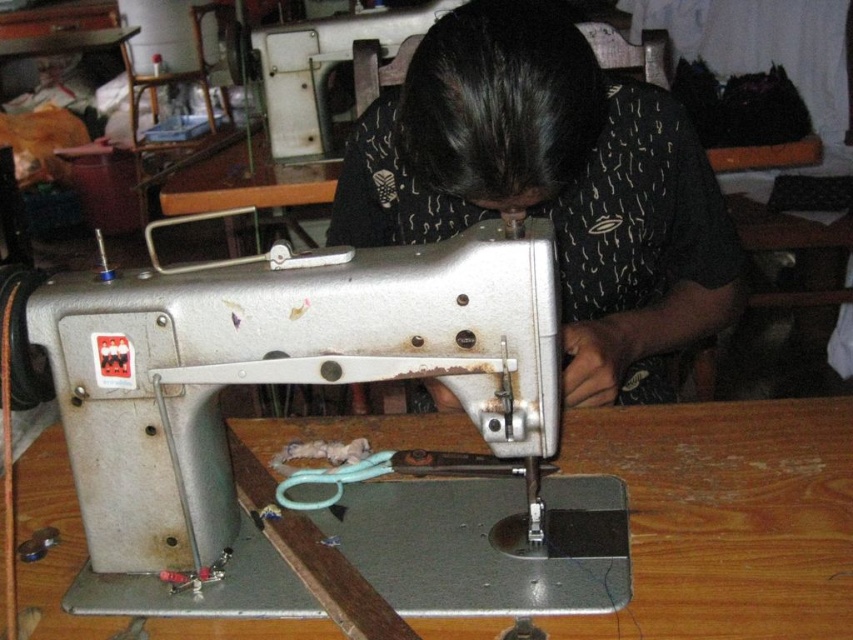
You are a tailor trying to reach the black printed shirt at upper center while working on the silver metallic sewing machine at center. Can you easily access the shirt without moving the sewing machine?

The silver metallic sewing machine at center is in front of the black printed shirt at upper center, so the sewing machine is blocking direct access to the shirt. You would need to move the sewing machine to reach the shirt easily.

You are standing in front of the sewing machine and want to place a tool on the nearest surface. Which object should you choose between the black printed shirt at upper center and the wooden table at center?

The wooden table at center is the correct surface to place the tool because the black printed shirt at upper center is closer to you but it is not a stable surface for placing items. The wooden table at center is further away but provides a solid and appropriate surface for placing tools.